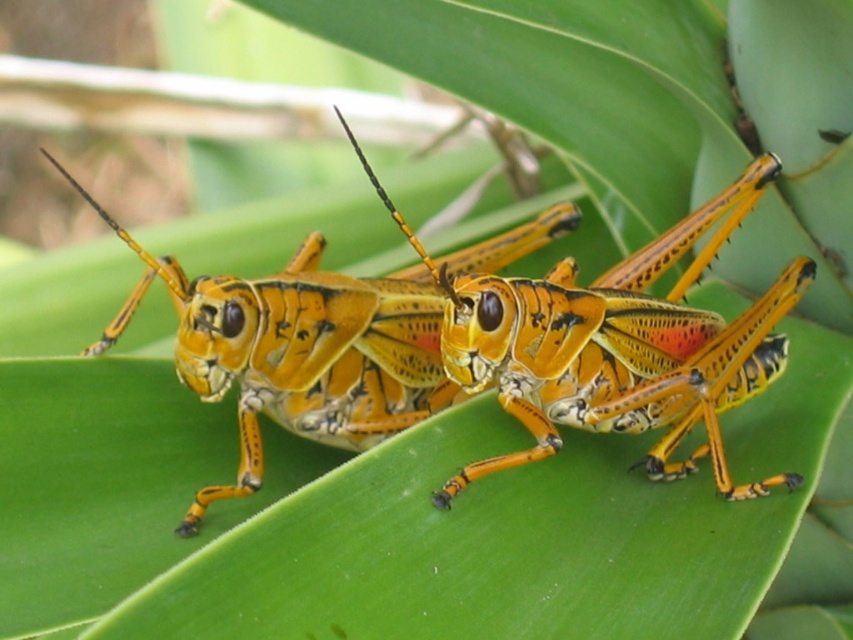
Question: Is orange-yellow textured grasshopper at center behind shiny orange grasshopper at center?

Choices:
 (A) yes
 (B) no

Answer: (B)

Question: Which of the following is the farthest from the observer?

Choices:
 (A) (625, 301)
 (B) (201, 310)

Answer: (A)

Question: From the image, what is the correct spatial relationship of orange-yellow textured grasshopper at center in relation to shiny orange grasshopper at center?

Choices:
 (A) right
 (B) left

Answer: (A)

Question: Does orange-yellow textured grasshopper at center come behind shiny orange grasshopper at center?

Choices:
 (A) yes
 (B) no

Answer: (B)

Question: Which object appears closest to the camera in this image?

Choices:
 (A) shiny orange grasshopper at center
 (B) orange-yellow textured grasshopper at center

Answer: (B)